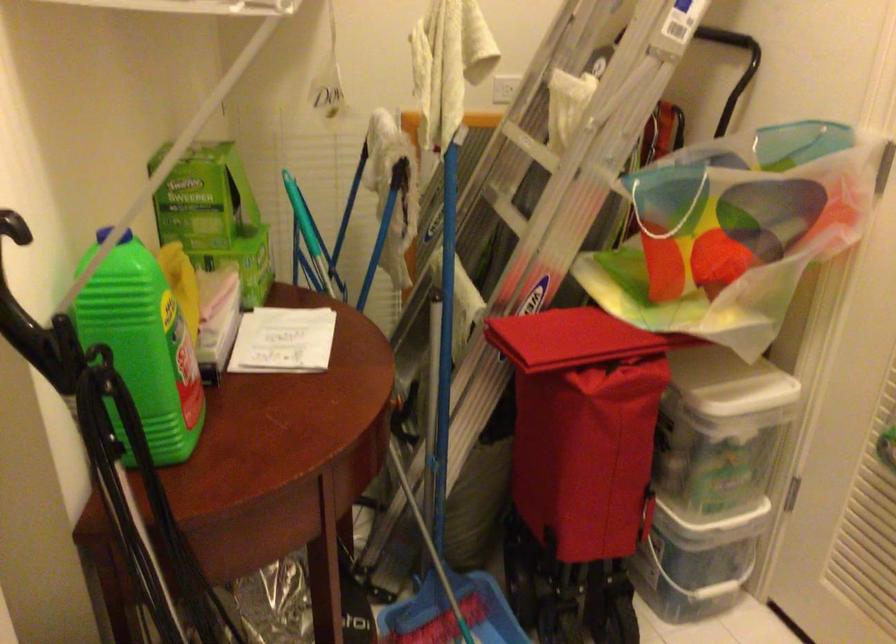
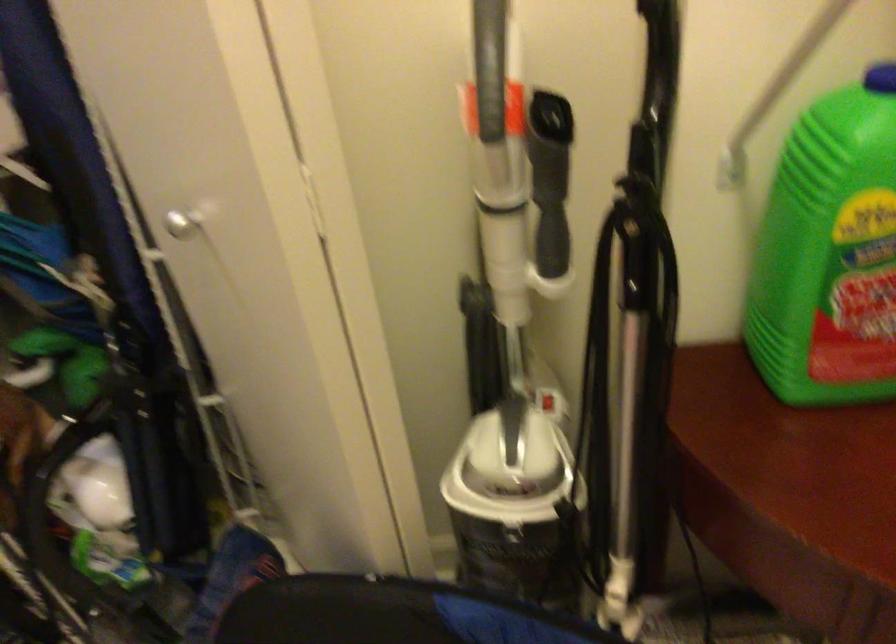
In the second image, find the point that corresponds to (x=128, y=486) in the first image.

(633, 348)